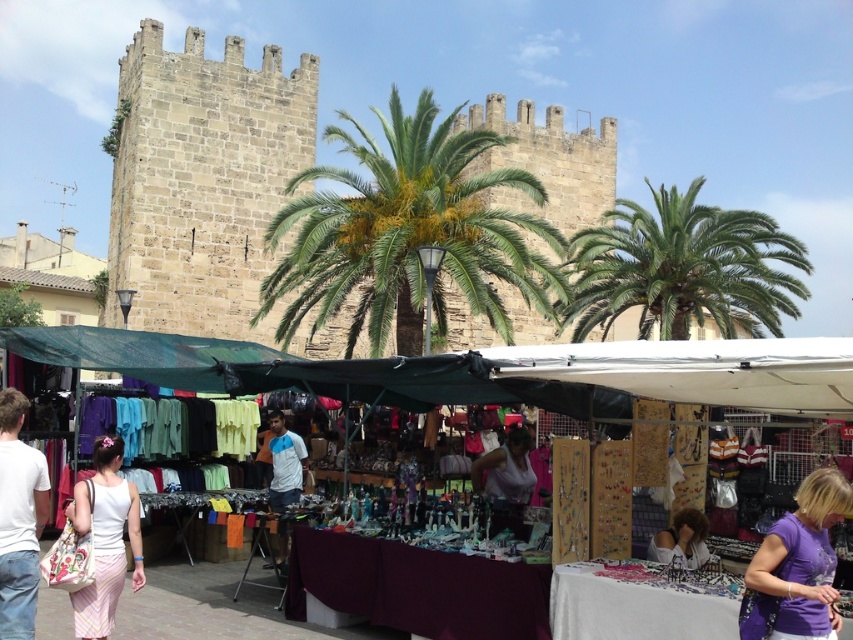
Is matte fabric stall at center thinner than purple cotton shirt at lower right?

In fact, matte fabric stall at center might be wider than purple cotton shirt at lower right.

Does point (375, 364) come closer to viewer compared to point (802, 554)?

No.

This screenshot has width=853, height=640. What are the coordinates of `matte fabric stall at center` in the screenshot? It's located at (490, 371).

Between purple cotton shirt at lower right and white cotton shirt at lower left, which one appears on the left side from the viewer's perspective?

From the viewer's perspective, white cotton shirt at lower left appears more on the left side.

Is purple cotton shirt at lower right positioned at the back of white cotton shirt at lower left?

No, purple cotton shirt at lower right is in front of white cotton shirt at lower left.

Is point (793, 628) positioned before point (38, 486)?

Yes.

What are the coordinates of `purple cotton shirt at lower right` in the screenshot? It's located at (798, 566).

Can you confirm if green leafy palm tree at upper center is bigger than white cotton shirt at lower left?

Yes, green leafy palm tree at upper center is bigger than white cotton shirt at lower left.

Is green leafy palm tree at upper center thinner than white cotton shirt at lower left?

No, green leafy palm tree at upper center is not thinner than white cotton shirt at lower left.

Find the location of a particular element. The width and height of the screenshot is (853, 640). green leafy palm tree at upper center is located at coordinates (683, 268).